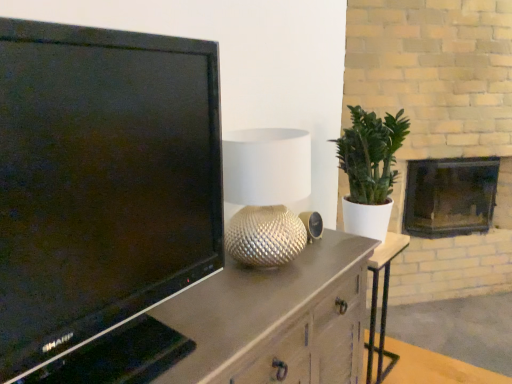
The height and width of the screenshot is (384, 512). In order to click on blank area beneath black glossy television at left (from a real-world perspective) in this screenshot , I will do `click(176, 332)`.